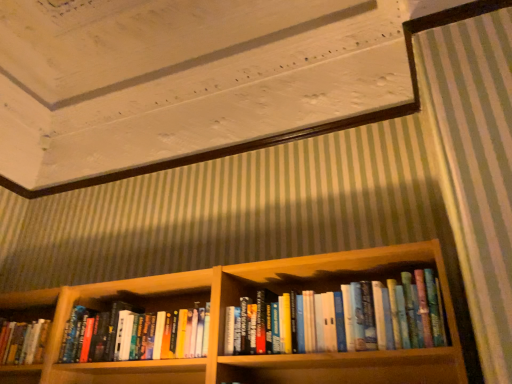
Question: Does wooden bookshelf at lower left touch wooden bookshelf at center?

Choices:
 (A) no
 (B) yes

Answer: (A)

Question: Is wooden bookshelf at lower left to the left of wooden bookshelf at center from the viewer's perspective?

Choices:
 (A) yes
 (B) no

Answer: (A)

Question: Considering the relative sizes of wooden bookshelf at lower left and wooden bookshelf at center in the image provided, is wooden bookshelf at lower left shorter than wooden bookshelf at center?

Choices:
 (A) yes
 (B) no

Answer: (A)

Question: Is wooden bookshelf at lower left thinner than wooden bookshelf at center?

Choices:
 (A) no
 (B) yes

Answer: (B)

Question: Is wooden bookshelf at lower left closer to camera compared to wooden bookshelf at center?

Choices:
 (A) no
 (B) yes

Answer: (A)

Question: Is wooden bookshelf at lower left smaller than wooden bookshelf at center?

Choices:
 (A) yes
 (B) no

Answer: (A)

Question: From the image's perspective, is hardcover books at center below wooden bookshelf at center?

Choices:
 (A) yes
 (B) no

Answer: (B)

Question: Is wooden bookshelf at center located within hardcover books at center?

Choices:
 (A) no
 (B) yes

Answer: (A)

Question: Considering the relative sizes of hardcover books at center and wooden bookshelf at center in the image provided, is hardcover books at center wider than wooden bookshelf at center?

Choices:
 (A) no
 (B) yes

Answer: (A)

Question: From a real-world perspective, is hardcover books at center on wooden bookshelf at center?

Choices:
 (A) yes
 (B) no

Answer: (B)

Question: Does hardcover books at center have a greater height compared to wooden bookshelf at center?

Choices:
 (A) no
 (B) yes

Answer: (A)

Question: Does hardcover books at center lie in front of wooden bookshelf at center?

Choices:
 (A) yes
 (B) no

Answer: (A)

Question: Is wooden bookshelf at center taller than hardcover books at center?

Choices:
 (A) yes
 (B) no

Answer: (A)